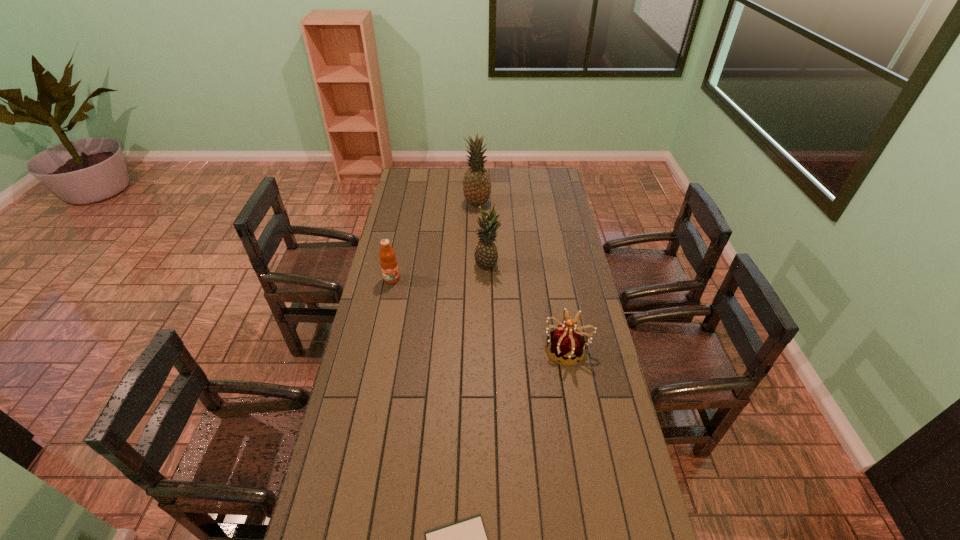
Locate an element on the screen. Image resolution: width=960 pixels, height=540 pixels. vacant space located 0.210m on the front label of the third nearest object is located at coordinates (383, 322).

You are a GUI agent. You are given a task and a screenshot of the screen. Output one action in this format:
    pyautogui.click(x=<x>, y=<y>)
    Task: Click on the vacant region located on the front-facing side of the rightmost object
    This screenshot has height=540, width=960.
    Given the screenshot: What is the action you would take?
    pyautogui.click(x=438, y=349)

Locate an element on the screen. The height and width of the screenshot is (540, 960). blank space located on the front-facing side of the rightmost object is located at coordinates (490, 349).

Where is `vacant space located on the front-facing side of the rightmost object`? This screenshot has height=540, width=960. vacant space located on the front-facing side of the rightmost object is located at coordinates (476, 349).

I want to click on object at the left edge, so click(388, 261).

Image resolution: width=960 pixels, height=540 pixels. In order to click on object that is at the right edge in this screenshot , I will do `click(567, 343)`.

This screenshot has height=540, width=960. In the image, there is a desktop. Find the location of `vacant space at the left edge`. vacant space at the left edge is located at coordinates (362, 372).

You are a GUI agent. You are given a task and a screenshot of the screen. Output one action in this format:
    pyautogui.click(x=<x>, y=<y>)
    Task: Click on the free space at the right edge of the desktop
    
    Given the screenshot: What is the action you would take?
    pyautogui.click(x=586, y=287)

Locate an element on the screen. The width and height of the screenshot is (960, 540). vacant space at the far right corner is located at coordinates (553, 180).

At what (x,y) coordinates should I click in order to perform the action: click on vacant point located between the nearer pineapple and the leftmost object. Please return your answer as a coordinate pair (x, y). Image resolution: width=960 pixels, height=540 pixels. Looking at the image, I should click on (440, 271).